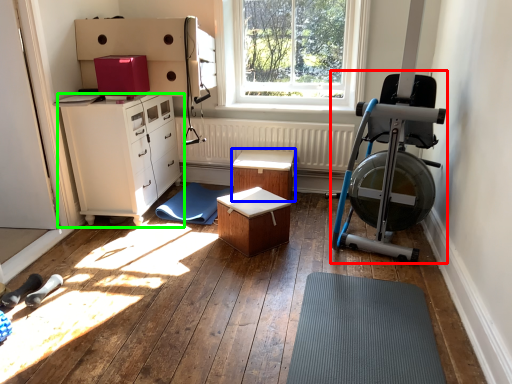
Question: Based on their relative distances, which object is farther from baby carriage (highlighted by a red box)? Choose from table (highlighted by a blue box) and chest of drawers (highlighted by a green box).

Choices:
 (A) table
 (B) chest of drawers

Answer: (B)